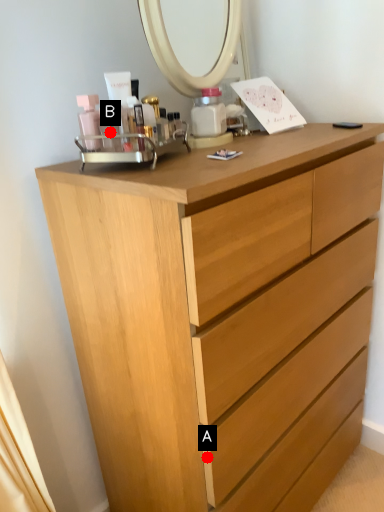
Question: Two points are circled on the image, labeled by A and B beside each circle. Which of the following is the closest to the observer?

Choices:
 (A) A is closer
 (B) B is closer

Answer: (A)